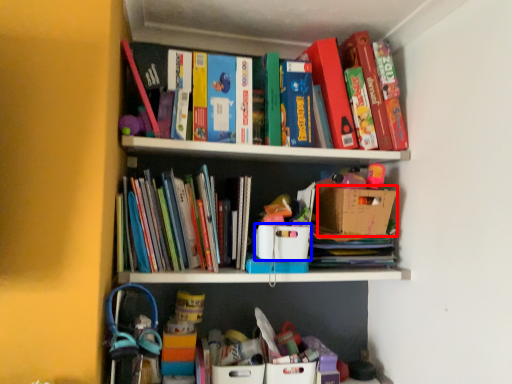
Question: Which point is closer to the camera, cardboard box (highlighted by a red box) or cardboard box (highlighted by a blue box)?

Choices:
 (A) cardboard box
 (B) cardboard box

Answer: (B)